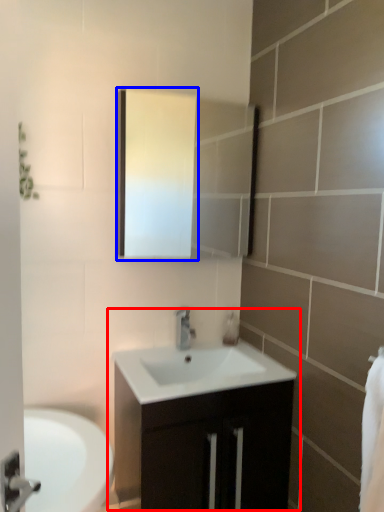
Question: Among these objects, which one is farthest to the camera, bathroom cabinet (highlighted by a red box) or medicine cabinet (highlighted by a blue box)?

Choices:
 (A) bathroom cabinet
 (B) medicine cabinet

Answer: (B)